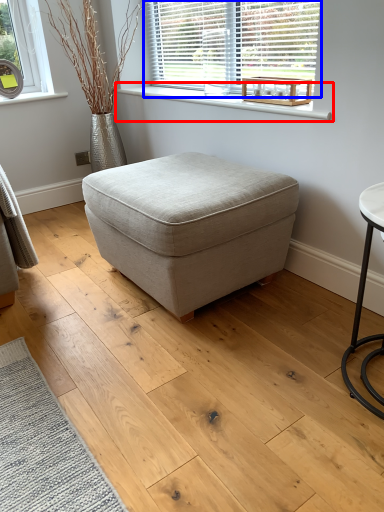
Question: Which object appears farthest to the camera in this image, window sill (highlighted by a red box) or window (highlighted by a blue box)?

Choices:
 (A) window sill
 (B) window

Answer: (B)